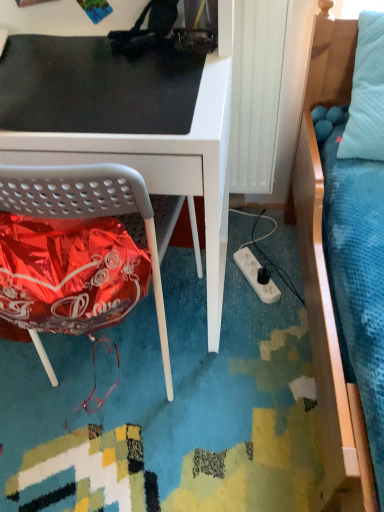
Question: Is white matte desk at center outside black matte mousepad at upper left?

Choices:
 (A) yes
 (B) no

Answer: (A)

Question: Can you confirm if white matte desk at center is wider than black matte mousepad at upper left?

Choices:
 (A) yes
 (B) no

Answer: (A)

Question: Is white matte desk at center next to black matte mousepad at upper left and touching it?

Choices:
 (A) no
 (B) yes

Answer: (B)

Question: Is white matte desk at center smaller than black matte mousepad at upper left?

Choices:
 (A) no
 (B) yes

Answer: (A)

Question: Does white matte desk at center appear on the left side of black matte mousepad at upper left?

Choices:
 (A) yes
 (B) no

Answer: (A)

Question: From the image's perspective, is white matte desk at center located beneath black matte mousepad at upper left?

Choices:
 (A) no
 (B) yes

Answer: (B)

Question: Can you confirm if white matte desk at center is thinner than white plastic power outlet at lower center?

Choices:
 (A) yes
 (B) no

Answer: (B)

Question: Is white matte desk at center positioned far away from white plastic power outlet at lower center?

Choices:
 (A) yes
 (B) no

Answer: (B)

Question: Are white matte desk at center and white plastic power outlet at lower center making contact?

Choices:
 (A) no
 (B) yes

Answer: (A)

Question: Could you tell me if white matte desk at center is facing white plastic power outlet at lower center?

Choices:
 (A) yes
 (B) no

Answer: (B)

Question: Can you confirm if white matte desk at center is shorter than white plastic power outlet at lower center?

Choices:
 (A) no
 (B) yes

Answer: (A)

Question: Is white matte desk at center at the right side of white plastic power outlet at lower center?

Choices:
 (A) no
 (B) yes

Answer: (A)

Question: Can you confirm if white plastic power outlet at lower center is positioned to the left of white matte desk at center?

Choices:
 (A) no
 (B) yes

Answer: (A)